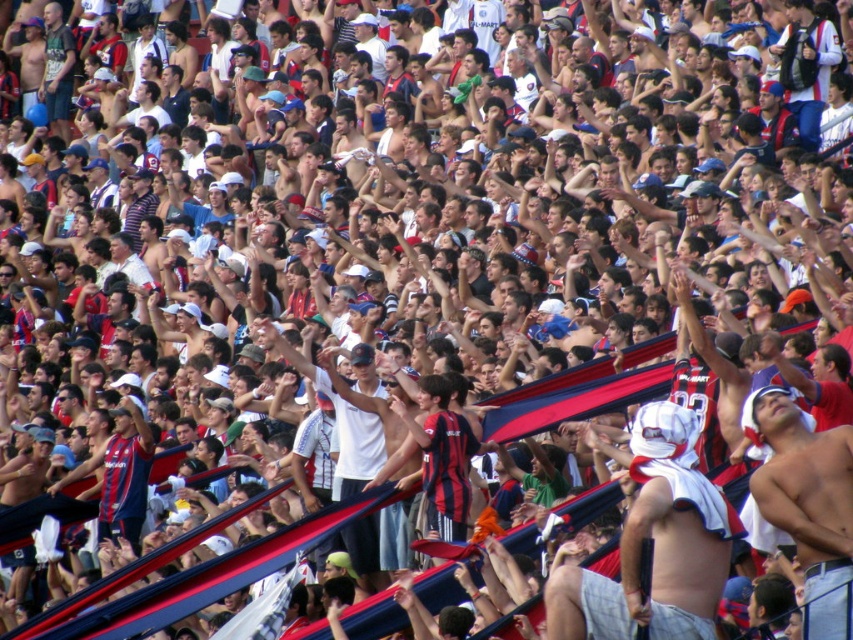
Question: Among these points, which one is farthest from the camera?

Choices:
 (A) (805, 529)
 (B) (668, 532)

Answer: (B)

Question: Does white fabric headband at center appear under shiny white towel at center?

Choices:
 (A) no
 (B) yes

Answer: (A)

Question: Does white fabric headband at center have a lesser width compared to shiny white towel at center?

Choices:
 (A) yes
 (B) no

Answer: (A)

Question: Where is white fabric headband at center located in relation to shiny white towel at center in the image?

Choices:
 (A) left
 (B) right

Answer: (A)